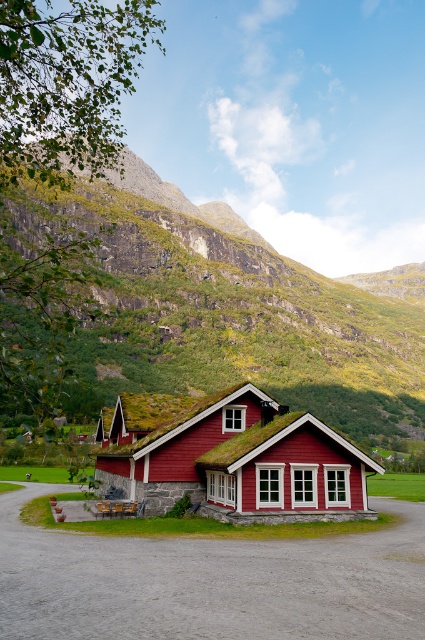
Question: Among these objects, which one is nearest to the camera?

Choices:
 (A) matte red wooden cottage at center
 (B) green moss-covered hillside at upper center

Answer: (B)

Question: Which object appears farthest from the camera in this image?

Choices:
 (A) matte red wooden cottage at center
 (B) green moss-covered hillside at upper center

Answer: (A)

Question: Is green moss-covered hillside at upper center bigger than matte red wooden cottage at center?

Choices:
 (A) no
 (B) yes

Answer: (B)

Question: Does green moss-covered hillside at upper center lie in front of matte red wooden cottage at center?

Choices:
 (A) yes
 (B) no

Answer: (A)

Question: Does green moss-covered hillside at upper center have a smaller size compared to matte red wooden cottage at center?

Choices:
 (A) yes
 (B) no

Answer: (B)